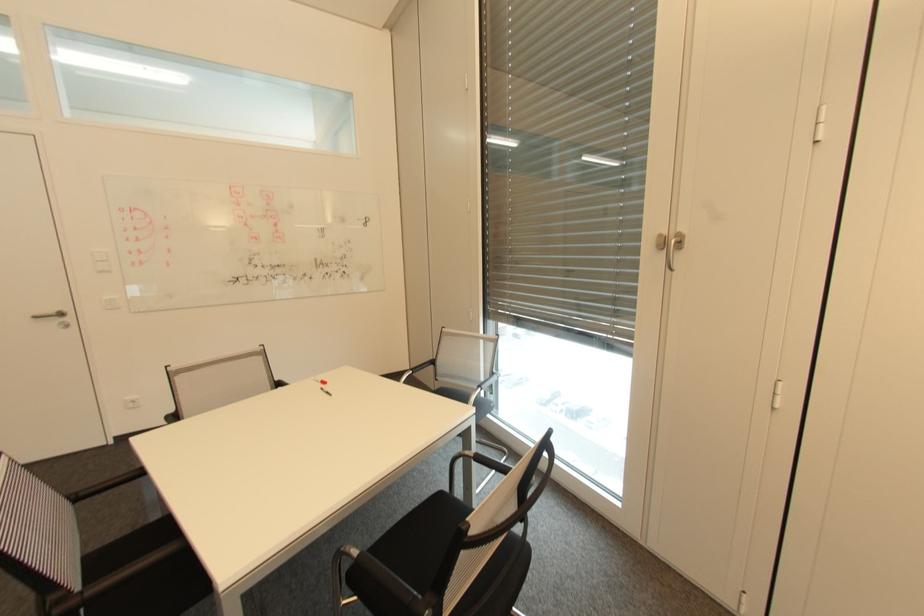
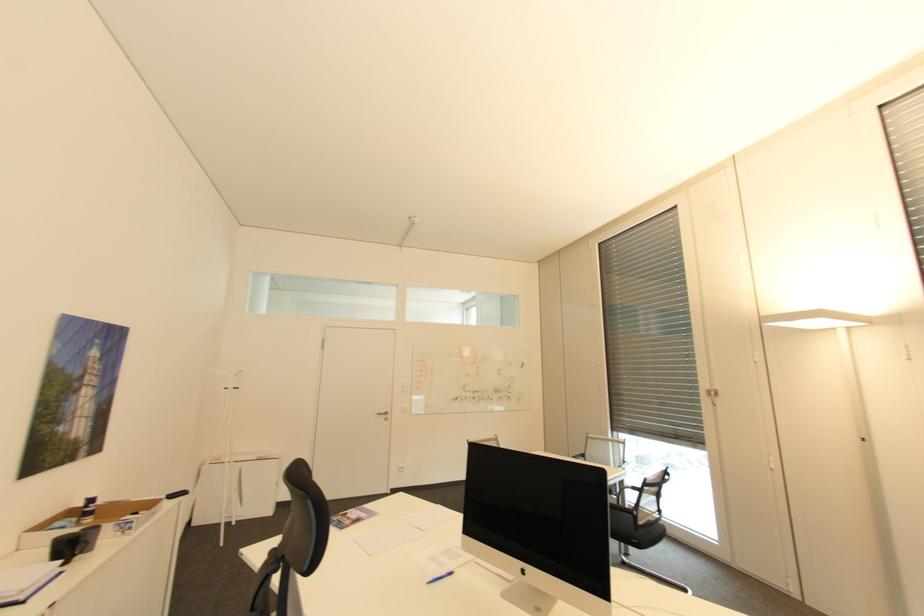
Question: In a continuous first-person perspective shot, in which direction is the camera moving?

Choices:
 (A) Left
 (B) Right
 (C) Forward
 (D) Backward

Answer: (D)